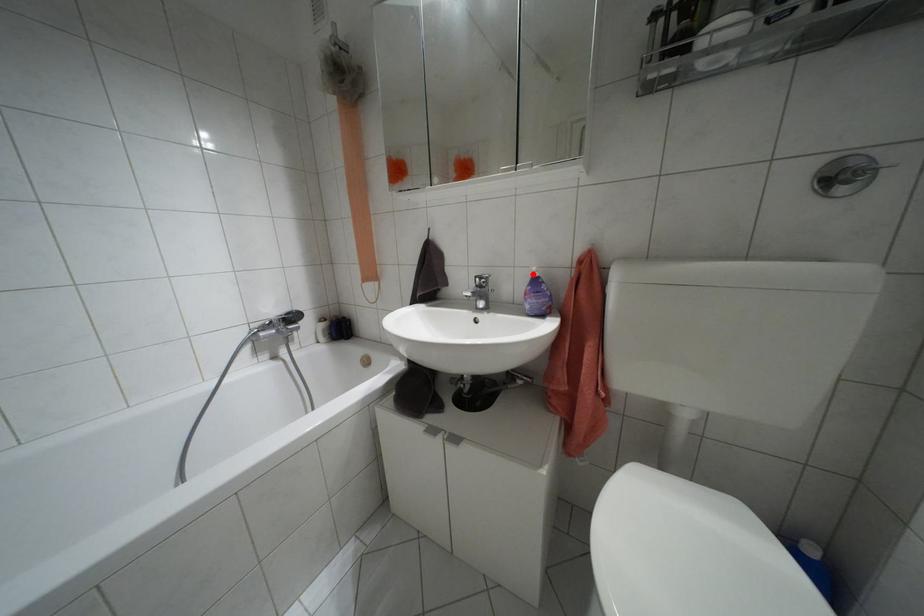
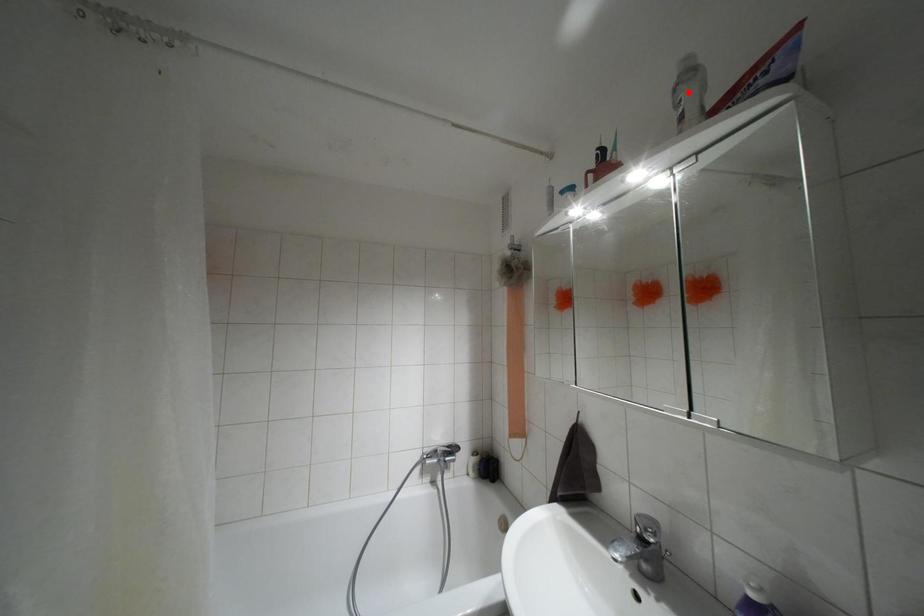
I am providing you with two images of the same scene from different viewpoints. A red point is marked on the first image and another point is marked on the second image. Is the red point in image1 aligned with the point shown in image2?

No